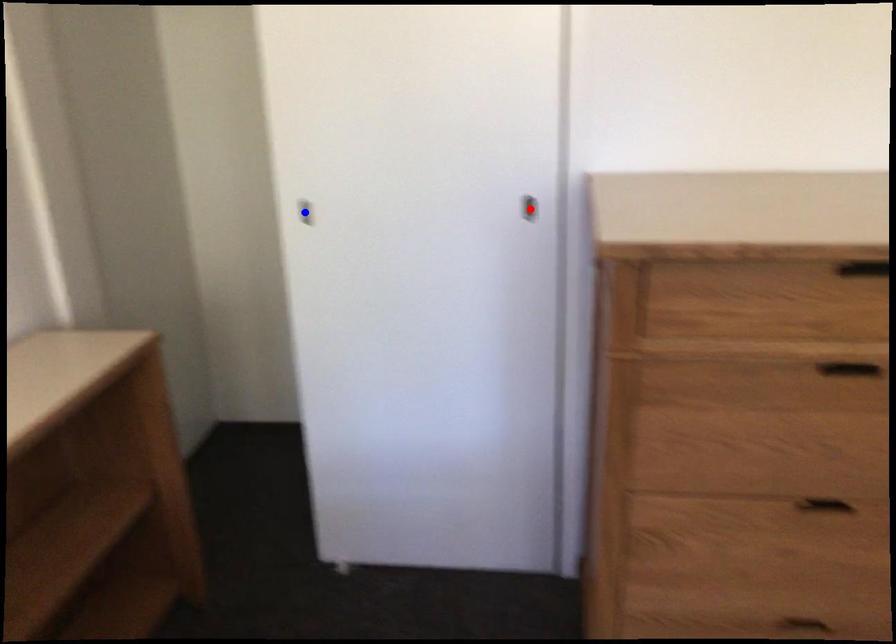
Question: Which of the two points in the image is closer to the camera?

Choices:
 (A) Blue point is closer.
 (B) Red point is closer.

Answer: (B)